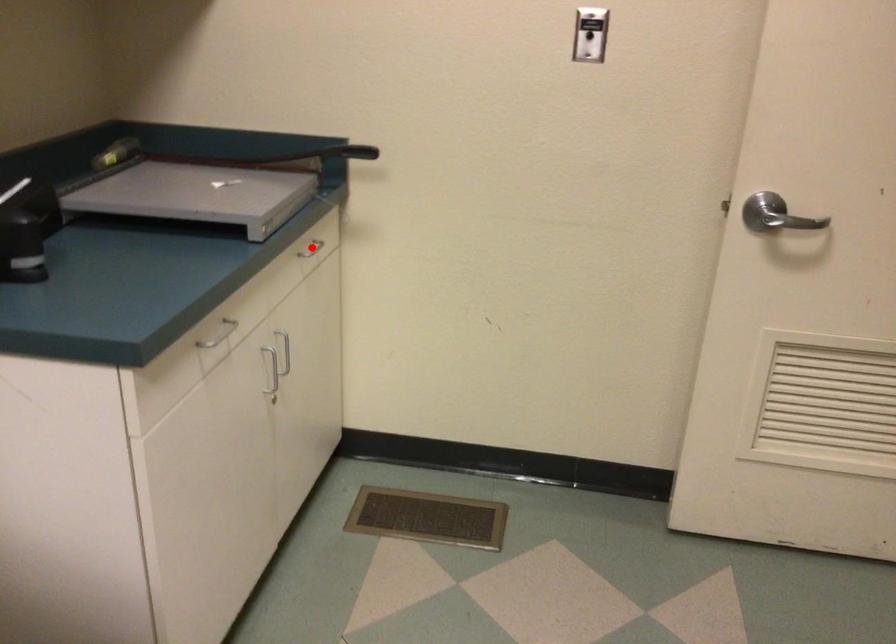
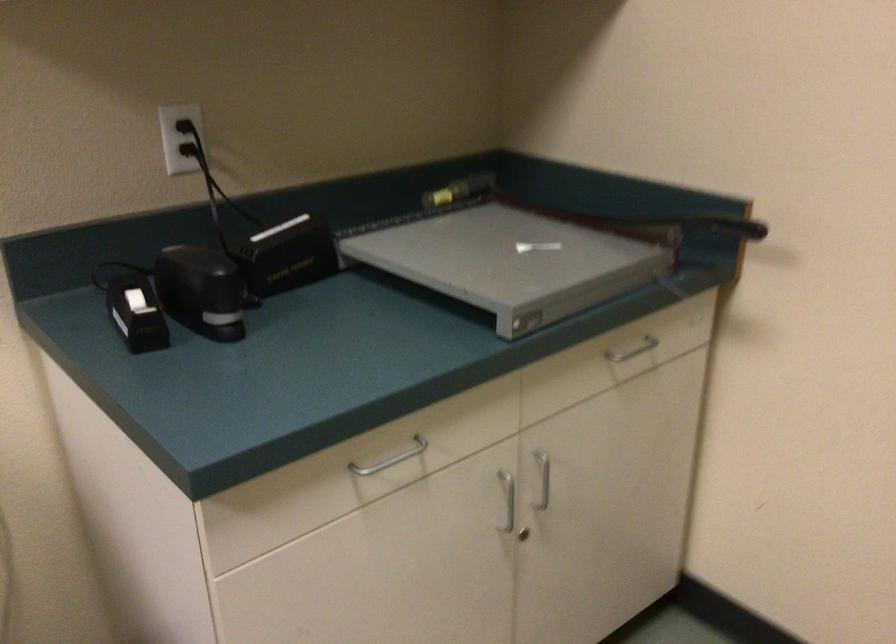
Question: A red point is marked in image1. In image2, is the corresponding 3D point closer to the camera or farther? Reply with the corresponding letter.

Choices:
 (A) The corresponding 3D point is closer.
 (B) The corresponding 3D point is farther.

Answer: (A)